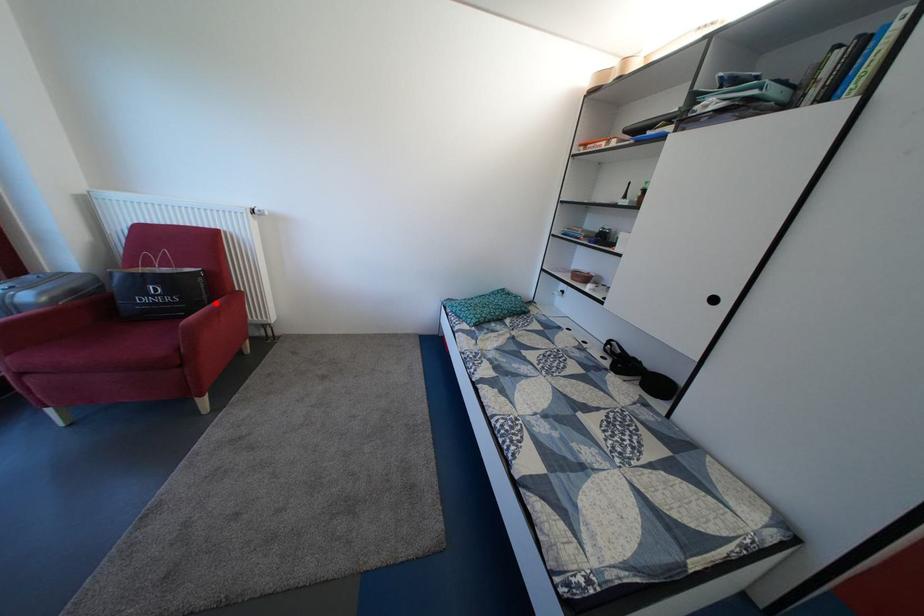
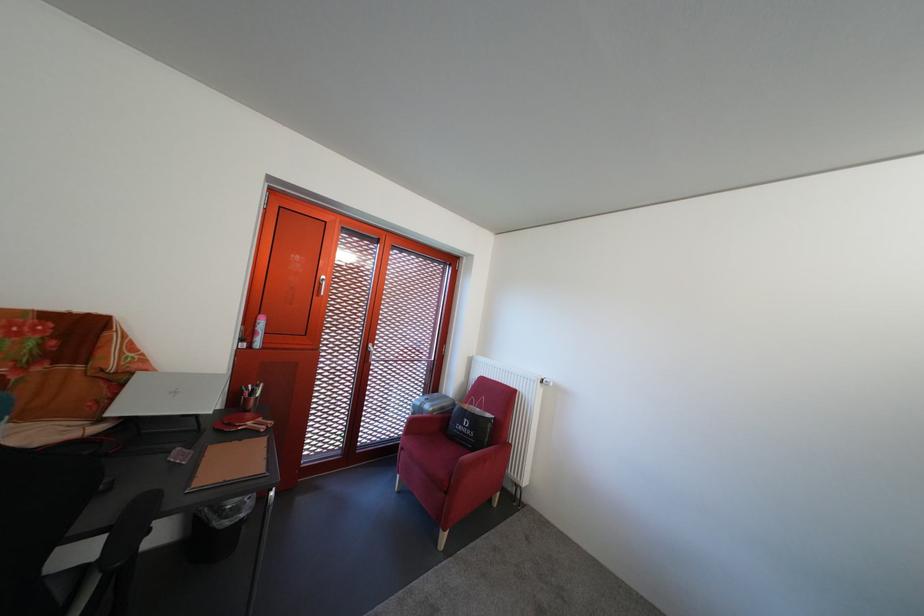
Question: A red point is marked in image1. In image2, is the corresponding 3D point closer to the camera or farther? Reply with the corresponding letter.

Choices:
 (A) The corresponding 3D point is closer.
 (B) The corresponding 3D point is farther.

Answer: (B)